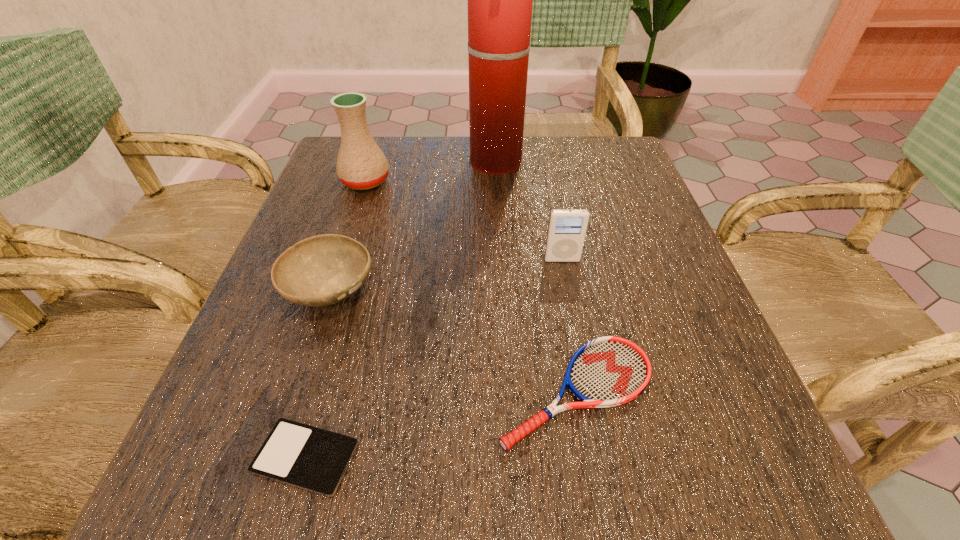
Locate an element on the screen. The width and height of the screenshot is (960, 540). free region located 0.070m with the nozzle and gauge on the fire extinguisher is located at coordinates (441, 163).

I want to click on blank space located 0.120m on the right of the pottery, so click(x=444, y=181).

Where is `vacant region located on the front-facing side of the taller iPod`? This screenshot has width=960, height=540. vacant region located on the front-facing side of the taller iPod is located at coordinates click(599, 450).

Locate an element on the screen. free region located on the back of the third shortest object is located at coordinates (370, 169).

This screenshot has height=540, width=960. In order to click on vacant space situated 0.070m on the right of the second shortest object in this screenshot , I will do `click(706, 392)`.

This screenshot has width=960, height=540. Find the location of `vacant space positioned 0.380m on the back of the shorter iPod`. vacant space positioned 0.380m on the back of the shorter iPod is located at coordinates (368, 239).

Identify the location of fire extinguisher present at the far edge. (x=500, y=0).

The height and width of the screenshot is (540, 960). What are the coordinates of `pottery at the far edge` in the screenshot? It's located at (361, 165).

In order to click on tennis racket situated at the near edge in this screenshot , I will do `click(608, 371)`.

I want to click on iPod at the near edge, so click(x=306, y=457).